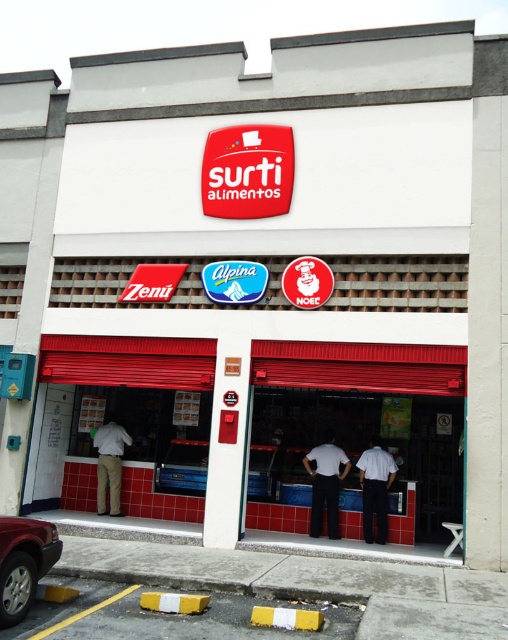
Does silver metallic car at lower left come in front of white uniform at center?

Yes, silver metallic car at lower left is in front of white uniform at center.

Is silver metallic car at lower left smaller than white uniform at center?

Yes, silver metallic car at lower left is smaller than white uniform at center.

Between point (21, 582) and point (382, 522), which one is positioned behind?

Point (382, 522)

Locate an element on the screen. Image resolution: width=508 pixels, height=640 pixels. silver metallic car at lower left is located at coordinates (23, 563).

Who is taller, silver metallic car at lower left or khaki pants at center?

khaki pants at center is taller.

Between point (51, 544) and point (97, 500), which one is positioned in front?

Point (51, 544) is in front.

Identify the location of silver metallic car at lower left. This screenshot has width=508, height=640. (23, 563).

Does white matte shirt at center appear under khaki pants at center?

Correct, white matte shirt at center is located below khaki pants at center.

Locate an element on the screen. This screenshot has width=508, height=640. white matte shirt at center is located at coordinates (326, 483).

This screenshot has height=640, width=508. What are the coordinates of `white matte shirt at center` in the screenshot? It's located at (326, 483).